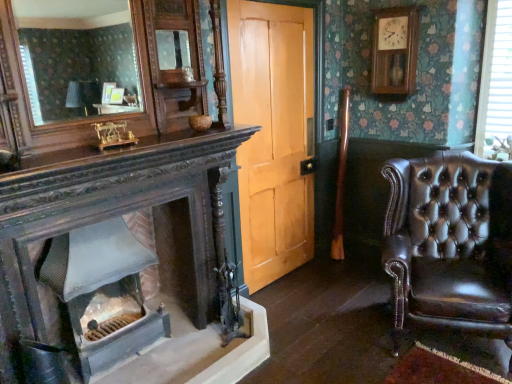
In order to click on vacant space situated on the left part of shiny brown leather armchair at right in this screenshot , I will do `click(331, 333)`.